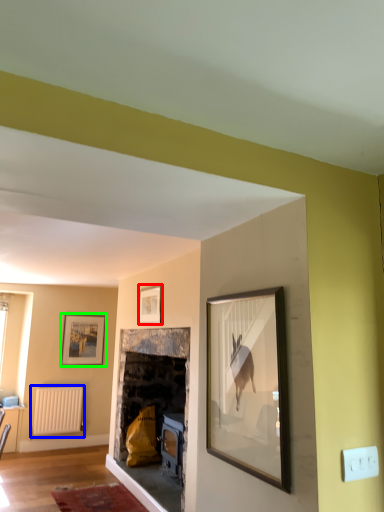
Question: Considering the real-world distances, which object is closest to picture frame (highlighted by a red box)? radiator (highlighted by a blue box) or picture frame (highlighted by a green box).

Choices:
 (A) radiator
 (B) picture frame

Answer: (B)